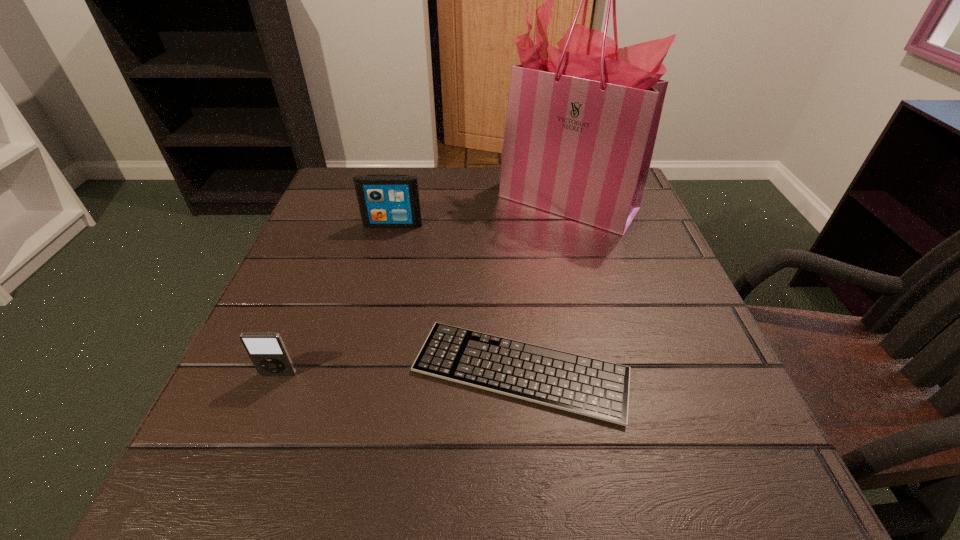
Choose which object is the second nearest neighbor to the second object from left to right. Please provide its 2D coordinates. Your answer should be formatted as a tuple, i.e. [(x, y)], where the tuple contains the x and y coordinates of a point satisfying the conditions above.

[(599, 389)]

At what (x,y) coordinates should I click in order to perform the action: click on vacant region that satisfies the following two spatial constraints: 1. on the front screen of the computer keyboard; 2. on the right side of the second object from left to right. Please return your answer as a coordinate pair (x, y). This screenshot has width=960, height=540. Looking at the image, I should click on (356, 371).

Locate an element on the screen. The width and height of the screenshot is (960, 540). vacant space that satisfies the following two spatial constraints: 1. on the front screen of the shortest object; 2. on the left side of the third object from right to left is located at coordinates (356, 371).

What are the coordinates of `vacant region that satisfies the following two spatial constraints: 1. on the front screen of the computer keyboard; 2. on the left side of the taller iPod` in the screenshot? It's located at (356, 371).